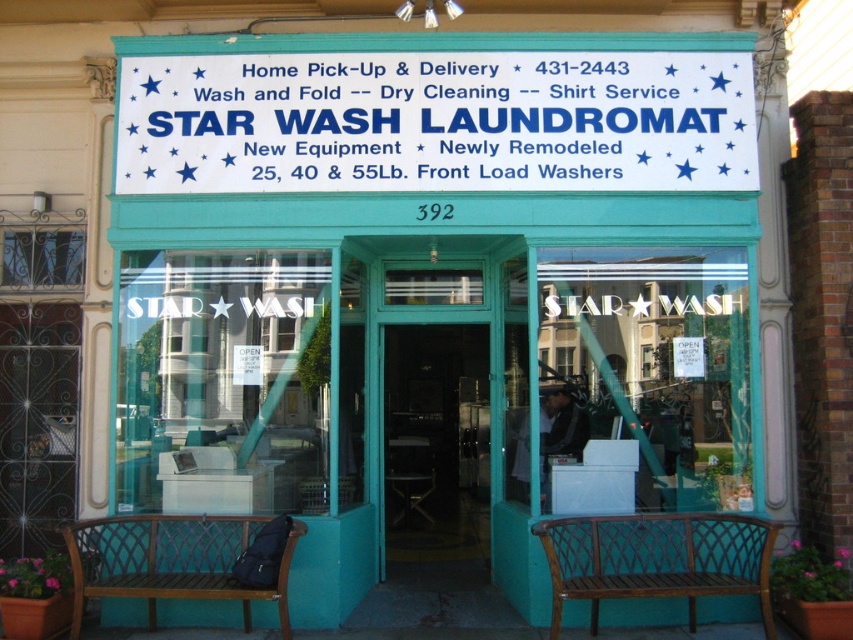
Can you confirm if brown wooden bench at lower center is smaller than brown wooden bench at lower left?

No, brown wooden bench at lower center is not smaller than brown wooden bench at lower left.

Who is more distant from viewer, (x=689, y=621) or (x=218, y=564)?

The point (x=218, y=564) is behind.

Locate an element on the screen. The image size is (853, 640). brown wooden bench at lower center is located at coordinates pyautogui.click(x=657, y=560).

Is transparent glass door at center closer to the viewer compared to brown wooden bench at lower left?

No, it is not.

In the scene shown: Between transparent glass door at center and brown wooden bench at lower left, which one is positioned higher?

transparent glass door at center

Which is in front, point (440, 387) or point (74, 604)?

Point (74, 604) is in front.

What are the coordinates of `transparent glass door at center` in the screenshot? It's located at (434, 442).

Is white/blue text sign at upper center shorter than brown wooden bench at lower center?

Incorrect, white/blue text sign at upper center's height does not fall short of brown wooden bench at lower center's.

Does white/blue text sign at upper center appear on the right side of brown wooden bench at lower center?

Incorrect, white/blue text sign at upper center is not on the right side of brown wooden bench at lower center.

Is point (560, 67) positioned before point (636, 566)?

No, it is behind (636, 566).

Where is `white/blue text sign at upper center`? The height and width of the screenshot is (640, 853). white/blue text sign at upper center is located at coordinates (436, 122).